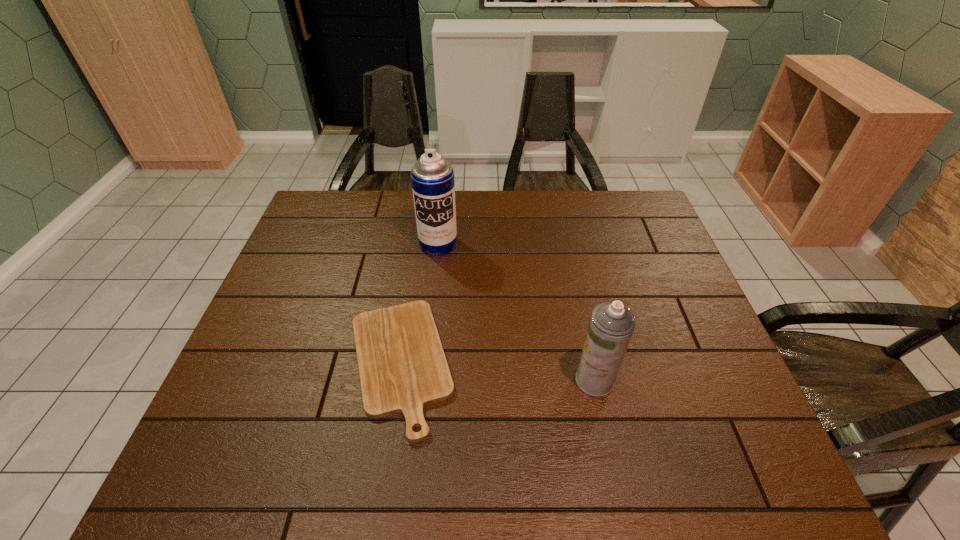
Find the location of a particular element. Image resolution: width=960 pixels, height=540 pixels. vacant area at the far edge of the desktop is located at coordinates (383, 212).

In the image, there is a desktop. Find the location of `vacant region at the left edge`. vacant region at the left edge is located at coordinates (313, 244).

Locate an element on the screen. free space at the right edge of the desktop is located at coordinates (682, 288).

Identify the location of free space at the far left corner of the desktop. The image size is (960, 540). (321, 201).

Locate an element on the screen. The width and height of the screenshot is (960, 540). vacant region at the far right corner is located at coordinates (607, 209).

Where is `free spot between the shortest object and the rightmost object`? This screenshot has width=960, height=540. free spot between the shortest object and the rightmost object is located at coordinates (497, 373).

Locate an element on the screen. This screenshot has width=960, height=540. free space between the right aerosol can and the tallest object is located at coordinates (516, 312).

Where is `empty space between the shortest object and the right aerosol can`? Image resolution: width=960 pixels, height=540 pixels. empty space between the shortest object and the right aerosol can is located at coordinates (497, 373).

Image resolution: width=960 pixels, height=540 pixels. I want to click on vacant area that lies between the shortest object and the right aerosol can, so tap(497, 373).

The width and height of the screenshot is (960, 540). In order to click on vacant space that is in between the chopping board and the rightmost object in this screenshot , I will do `click(497, 373)`.